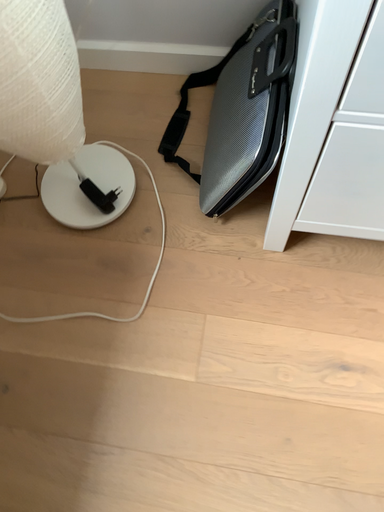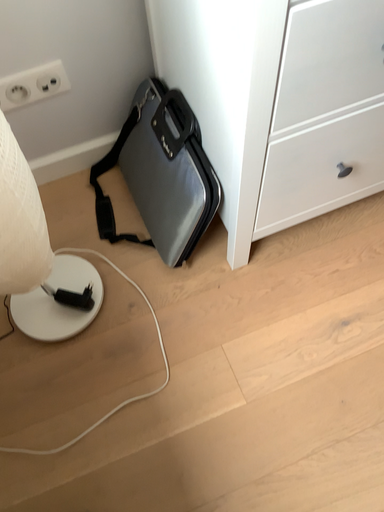
Question: How did the camera likely rotate when shooting the video?

Choices:
 (A) rotated upward
 (B) rotated downward

Answer: (A)